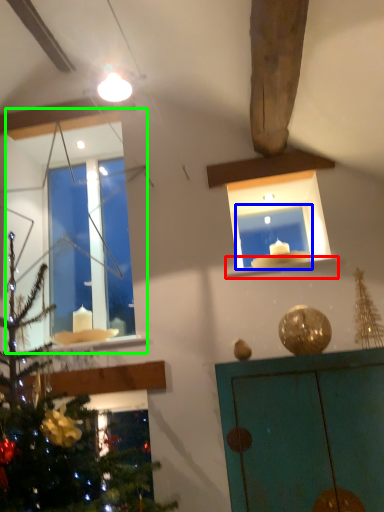
Question: Which object is positioned farthest from window sill (highlighted by a red box)? Select from window frame (highlighted by a blue box) and window (highlighted by a green box).

Choices:
 (A) window frame
 (B) window

Answer: (B)